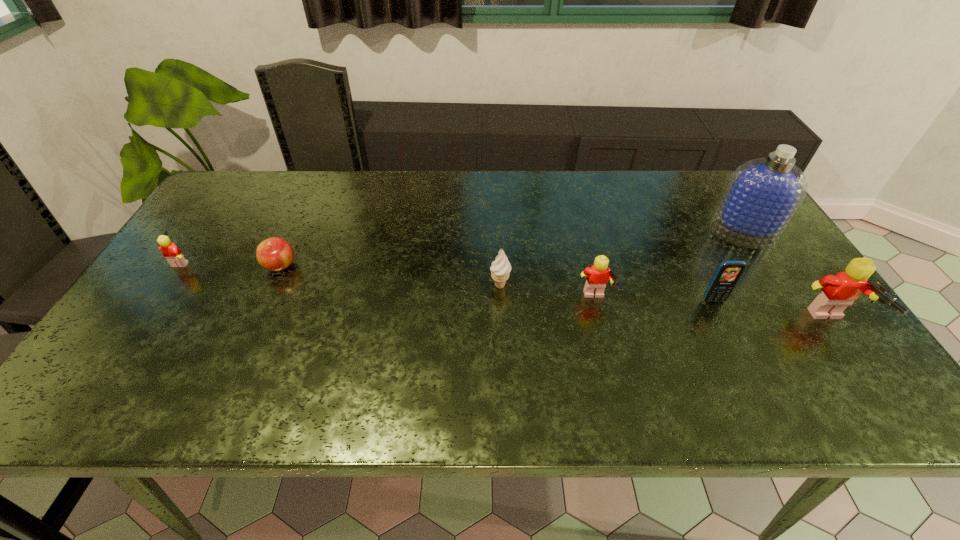
Locate an element on the screen. the third object from right to left is located at coordinates (728, 273).

At what (x,y) coordinates should I click in order to perform the action: click on free location located 0.240m in front of the fourth object from right to left with the accessory visible. Please return your answer as a coordinate pair (x, y). Looking at the image, I should click on (708, 300).

Where is `free space located 0.190m on the back of the tallest object`? The width and height of the screenshot is (960, 540). free space located 0.190m on the back of the tallest object is located at coordinates (708, 182).

Where is `vacant space located on the back of the shortest object`? The image size is (960, 540). vacant space located on the back of the shortest object is located at coordinates (317, 184).

Locate an element on the screen. The image size is (960, 540). vacant space located 0.210m on the front-facing side of the icecream is located at coordinates (408, 286).

Locate an element on the screen. This screenshot has height=540, width=960. free space located 0.110m on the front-facing side of the icecream is located at coordinates (446, 286).

This screenshot has height=540, width=960. In order to click on vacant point located 0.220m on the front-facing side of the icecream in this screenshot , I will do `click(404, 286)`.

Identify the location of vacant space situated on the screen of the fifth object from left to right. (739, 355).

This screenshot has height=540, width=960. What are the coordinates of `object at the near edge` in the screenshot? It's located at (839, 291).

Image resolution: width=960 pixels, height=540 pixels. In order to click on object at the left edge in this screenshot , I will do `click(170, 251)`.